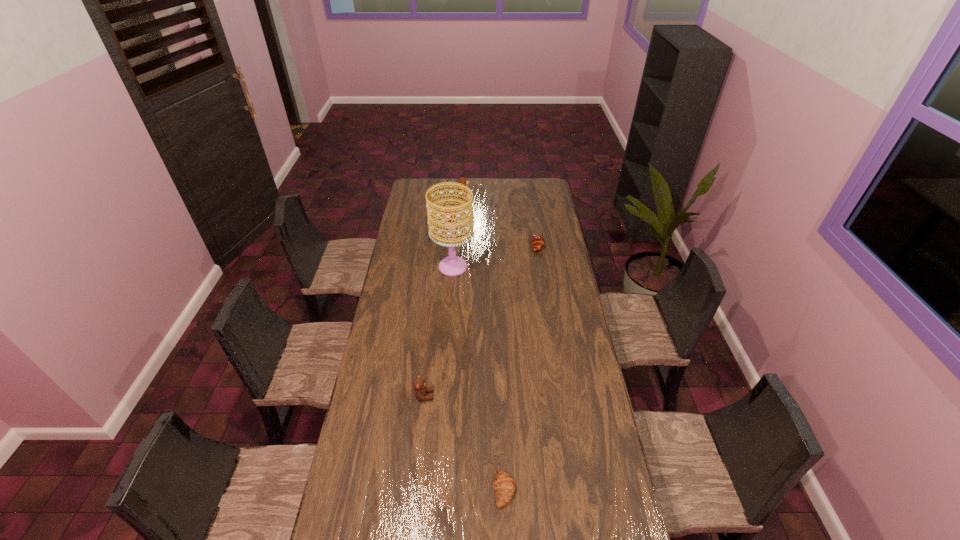
In order to click on the tallest object in this screenshot , I will do `click(453, 265)`.

The height and width of the screenshot is (540, 960). In order to click on the farthest object in this screenshot , I will do 462,180.

Find the location of a particular element. Image resolution: width=960 pixels, height=540 pixels. the farther teddy bear is located at coordinates (462, 180).

I want to click on the nearer teddy bear, so click(421, 389).

Identify the location of the second nearest object. The image size is (960, 540). (421, 389).

The image size is (960, 540). Find the location of `the farther crescent roll`. the farther crescent roll is located at coordinates (538, 242).

Image resolution: width=960 pixels, height=540 pixels. In order to click on the right crescent roll in this screenshot , I will do (538, 242).

You are a GUI agent. You are given a task and a screenshot of the screen. Output one action in this format:
    pyautogui.click(x=<x>, y=<y>)
    Task: Click on the second object from right to left
    
    Given the screenshot: What is the action you would take?
    pyautogui.click(x=504, y=486)

Identify the location of the nearer crescent roll. (504, 486).

Identify the location of vacant space located 0.170m on the left of the tallest object. (398, 266).